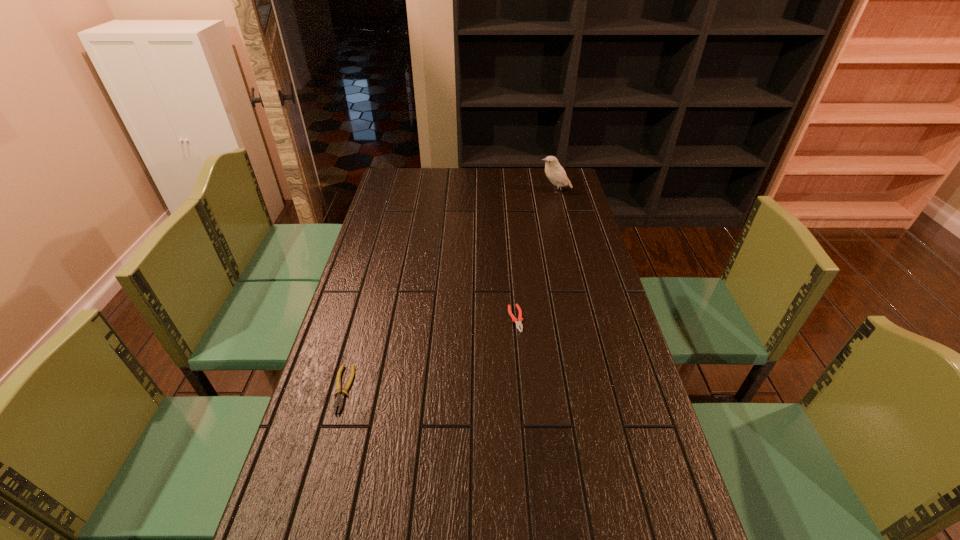
This screenshot has width=960, height=540. I want to click on free space between the second nearest object and the bird, so click(x=536, y=255).

Find the location of `vacant area that lies between the right pliers and the nearer pliers`. vacant area that lies between the right pliers and the nearer pliers is located at coordinates (429, 354).

The width and height of the screenshot is (960, 540). Identify the location of free spot between the farthest object and the farther pliers. (536, 255).

The height and width of the screenshot is (540, 960). Identify the location of free area in between the farthest object and the left pliers. 448,290.

Locate an element on the screen. This screenshot has height=540, width=960. vacant area that lies between the leftmost object and the second farthest object is located at coordinates (429, 354).

Locate an element on the screen. The width and height of the screenshot is (960, 540). vacant space in between the second farthest object and the left pliers is located at coordinates (429, 354).

The height and width of the screenshot is (540, 960). In order to click on unoccupied area between the tallest object and the second object from left to right in this screenshot , I will do `click(536, 255)`.

Identify the location of blank region between the nearest object and the right pliers. (429, 354).

Where is `empty space that is in between the farthest object and the nearer pliers`? The height and width of the screenshot is (540, 960). empty space that is in between the farthest object and the nearer pliers is located at coordinates (448, 290).

Locate which object is the second closest to the farther pliers. Please provide its 2D coordinates. Your answer should be formatted as a tuple, i.e. [(x, y)], where the tuple contains the x and y coordinates of a point satisfying the conditions above.

[(554, 171)]